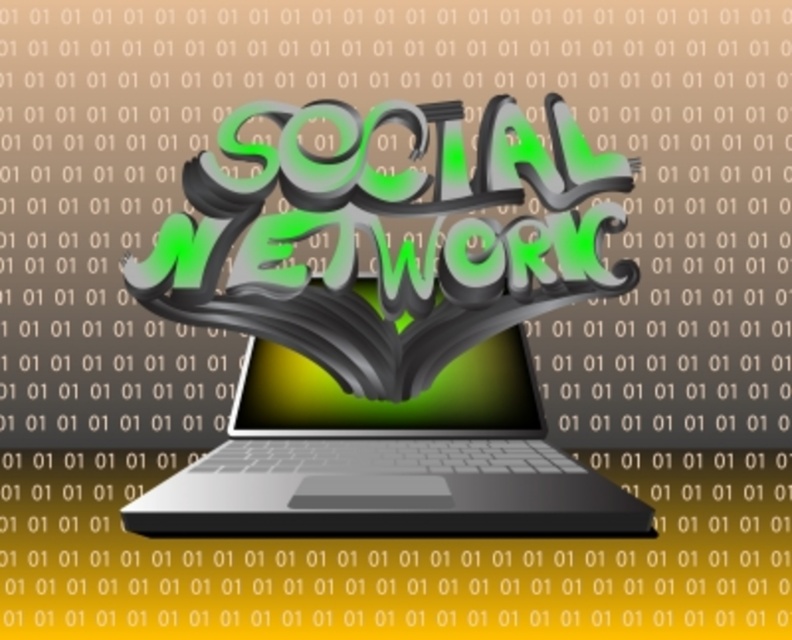
You are a photographer who needs to take a clear picture of the satin black laptop at center using a camera. The camera has a minimum focus distance of 16 inches. Can you take a clear photo without moving the camera or the laptop?

The satin black laptop at center and camera are 16.24 inches apart from each other. Since the minimum focus distance is 16 inches, the camera can focus on the laptop as the distance is slightly more than the required minimum. Therefore, you can take a clear photo without moving either.

You are an interior designer working on a project that requires precise placement of a satin black laptop at center. According to the provided coordinates, where should you position the laptop in the design layout?

The satin black laptop at center should be positioned at coordinates point (x=387, y=458) as specified in the description.

You are designing a poster for a tech conference and want to ensure the laptop and screen from the image are proportionally accurate. Given that the shiny metallic screen at center is 12 inches wide, what should be the minimum width of the satin black laptop at center to maintain the correct proportions?

The satin black laptop at center is bigger than shiny metallic screen at center. Since the screen is 12 inches wide, the laptop should be wider than 12 inches to maintain the correct proportions.